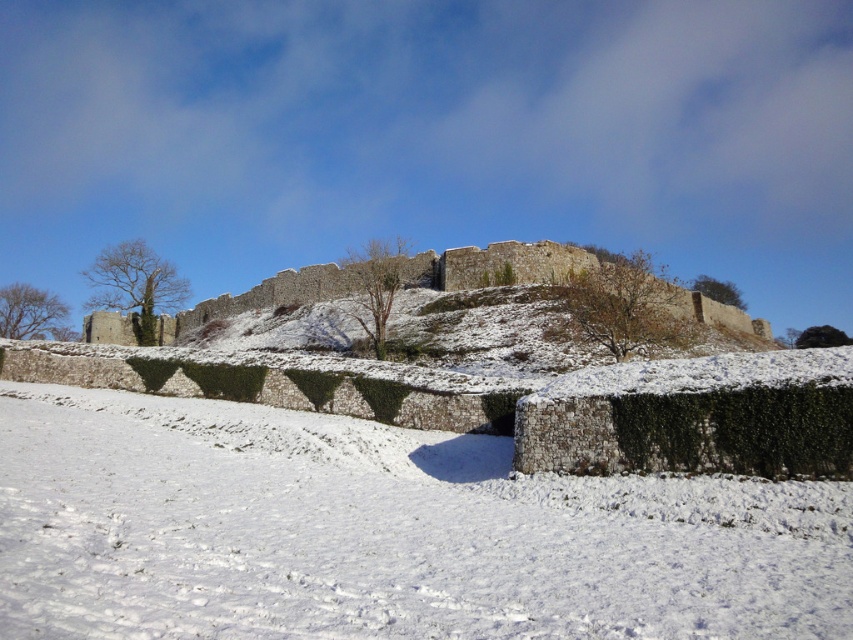
You are standing at the base of the historic stone structure and see the point marked at coordinates [381,532]. What is the surface condition at that point?

The point at coordinates [381,532] is located on white fluffy snow at center, so the surface there is covered with snow.